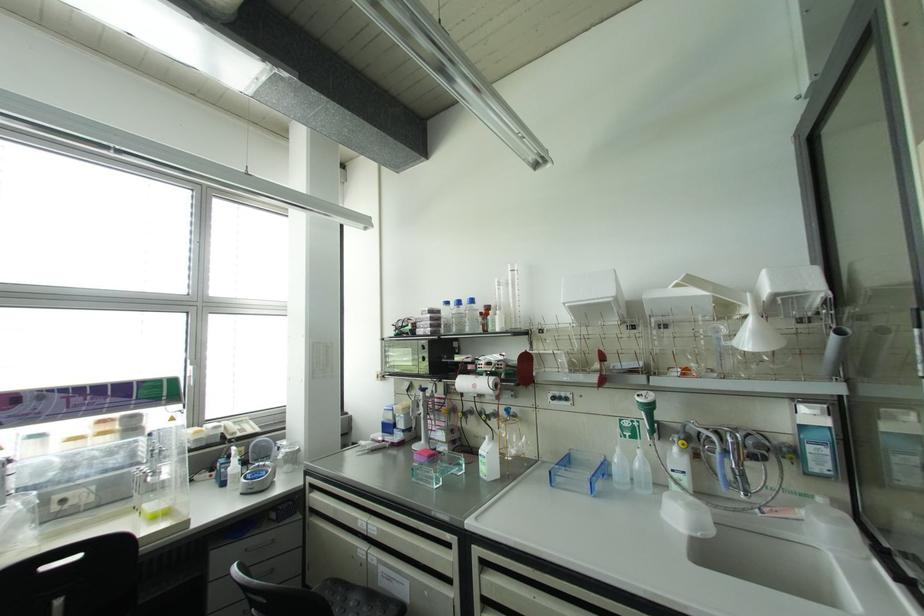
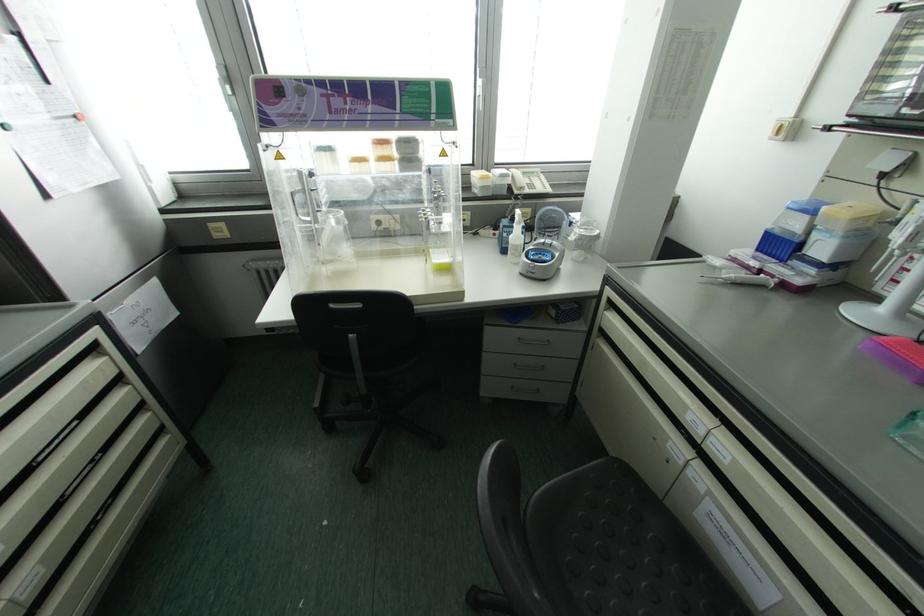
In the second image, find the point that corresponds to the point at 228,437 in the first image.

(515, 191)